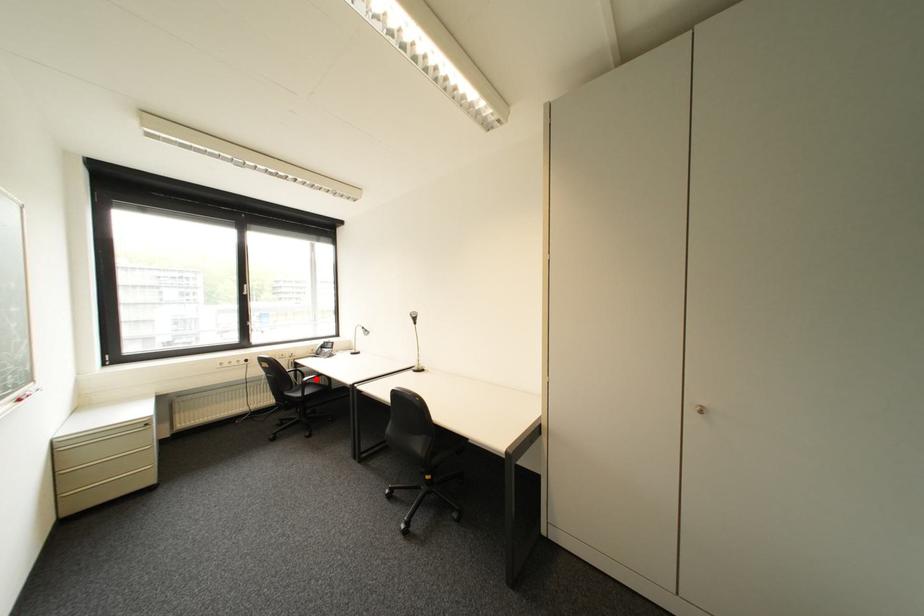
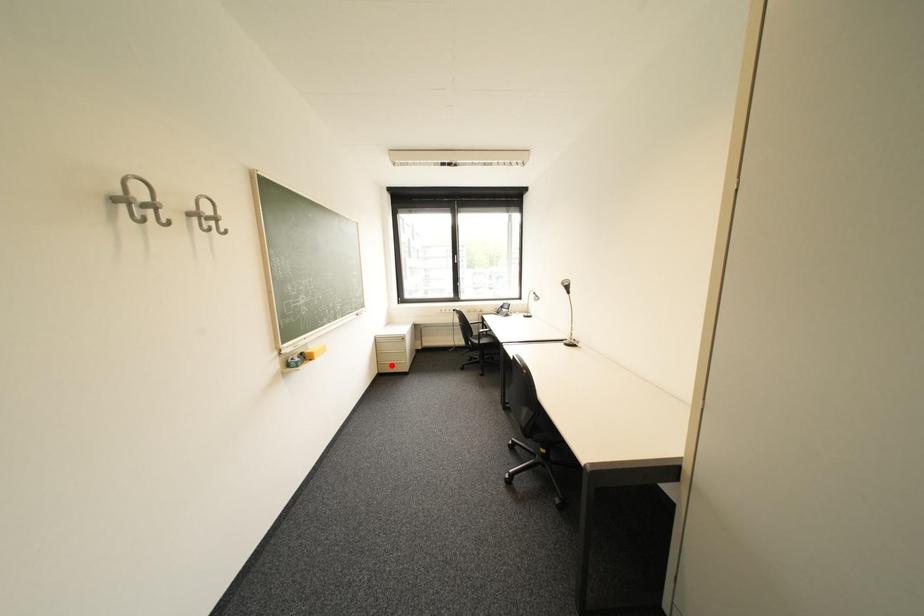
I am providing you with two images of the same scene from different viewpoints. A red point is marked on the first image and another point is marked on the second image. Is the red point in image1 aligned with the point shown in image2?

No